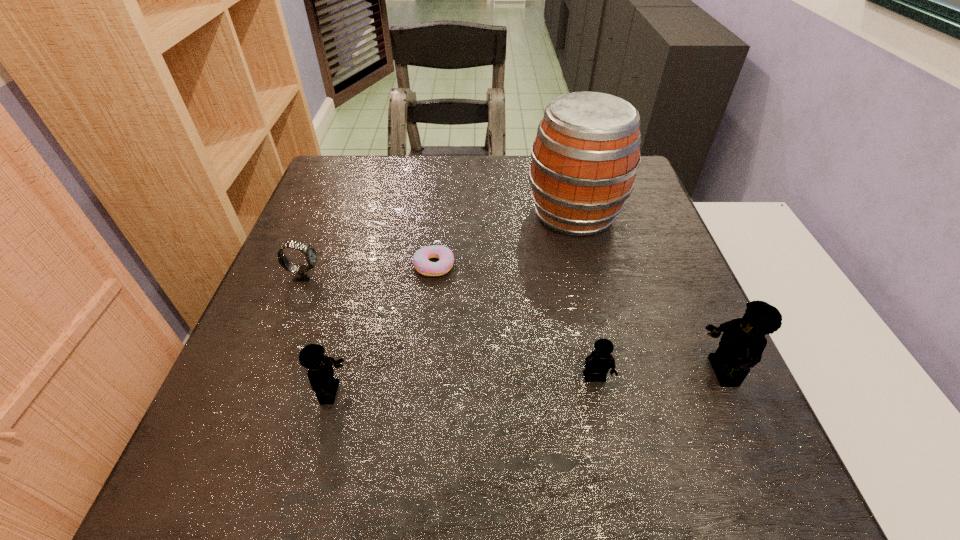
You are a GUI agent. You are given a task and a screenshot of the screen. Output one action in this format:
    pyautogui.click(x=<x>, y=<y>)
    Task: Click on the free space between the third object from left to right and the second tallest Lego
    
    Given the screenshot: What is the action you would take?
    pyautogui.click(x=382, y=329)

In order to click on vacant space that's between the cider and the tallest Lego in this screenshot , I will do (x=648, y=292).

Identify which object is located as the second nearest to the second Lego from left to right. Please provide its 2D coordinates. Your answer should be formatted as a tuple, i.e. [(x, y)], where the tuple contains the x and y coordinates of a point satisfying the conditions above.

[(420, 260)]

Find the location of a particular element. This screenshot has height=540, width=960. object that is the fifth closest to the fifth object from right to left is located at coordinates (743, 341).

Where is `the closest Lego to the second Lego from right to left`? The width and height of the screenshot is (960, 540). the closest Lego to the second Lego from right to left is located at coordinates (743, 341).

Where is `Lego that is the second closest to the leftmost object`? Image resolution: width=960 pixels, height=540 pixels. Lego that is the second closest to the leftmost object is located at coordinates (598, 363).

Where is `free location that satisfies the following two spatial constraints: 1. on the front-facing side of the shortest Lego; 2. on the front-facing side of the third tallest object`? This screenshot has height=540, width=960. free location that satisfies the following two spatial constraints: 1. on the front-facing side of the shortest Lego; 2. on the front-facing side of the third tallest object is located at coordinates (598, 393).

Identify the location of free space that satisfies the following two spatial constraints: 1. on the front-facing side of the shortest Lego; 2. on the front-facing side of the fifth object from right to left. (598, 393).

Find the location of a particular element. The height and width of the screenshot is (540, 960). free space that satisfies the following two spatial constraints: 1. on the front-facing side of the rightmost Lego; 2. on the front-facing side of the second Lego from right to left is located at coordinates (725, 378).